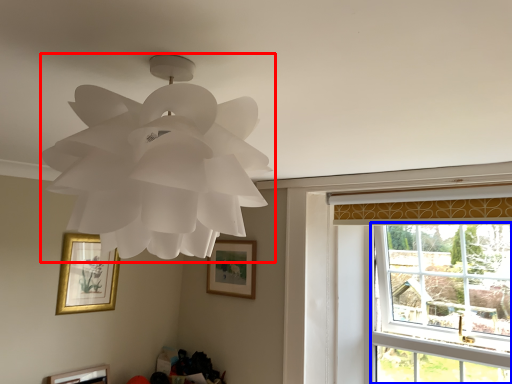
Question: Which object appears farthest to the camera in this image, lamp (highlighted by a red box) or window (highlighted by a blue box)?

Choices:
 (A) lamp
 (B) window

Answer: (B)